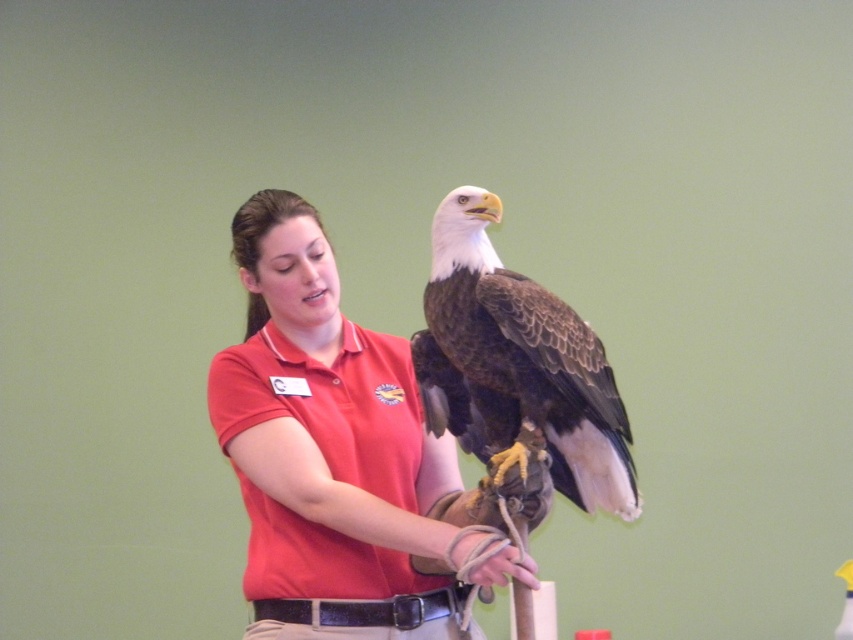
Question: Is brown feathered eagle at center smaller than leather glove at center?

Choices:
 (A) no
 (B) yes

Answer: (A)

Question: Observing the image, what is the correct spatial positioning of matte red shirt at center in reference to leather glove at center?

Choices:
 (A) below
 (B) above

Answer: (B)

Question: Among these points, which one is nearest to the camera?

Choices:
 (A) (532, 289)
 (B) (282, 500)
 (C) (473, 547)

Answer: (C)

Question: Does brown feathered eagle at center have a greater width compared to leather glove at center?

Choices:
 (A) yes
 (B) no

Answer: (A)

Question: Which object is farther from the camera taking this photo?

Choices:
 (A) matte red shirt at center
 (B) leather glove at center

Answer: (A)

Question: Which is farther from the leather glove at center?

Choices:
 (A) brown feathered eagle at center
 (B) matte red shirt at center

Answer: (B)